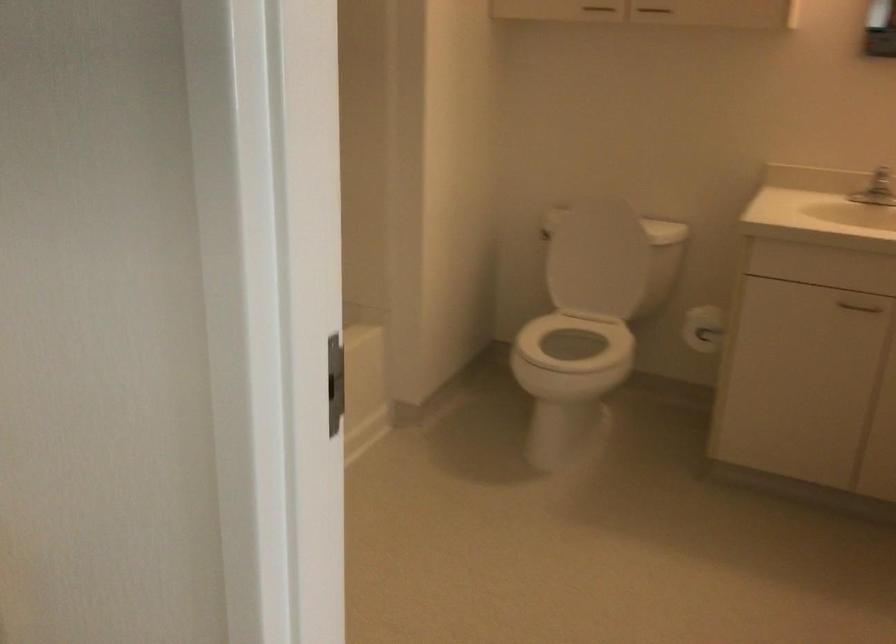
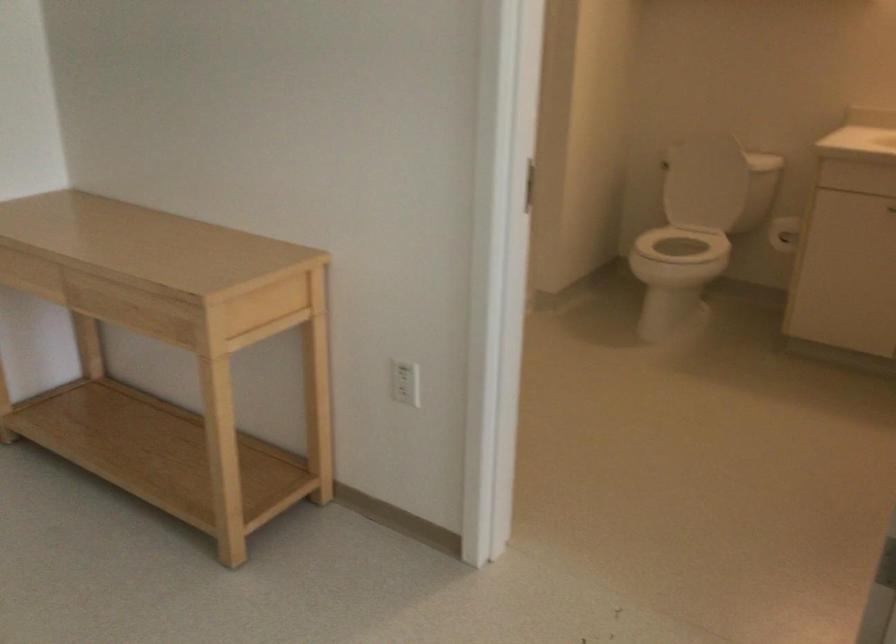
Question: Which direction would the cameraman need to move to produce the second image? Reply with the corresponding letter.

Choices:
 (A) Left
 (B) Right
 (C) Forward
 (D) Backward

Answer: (D)